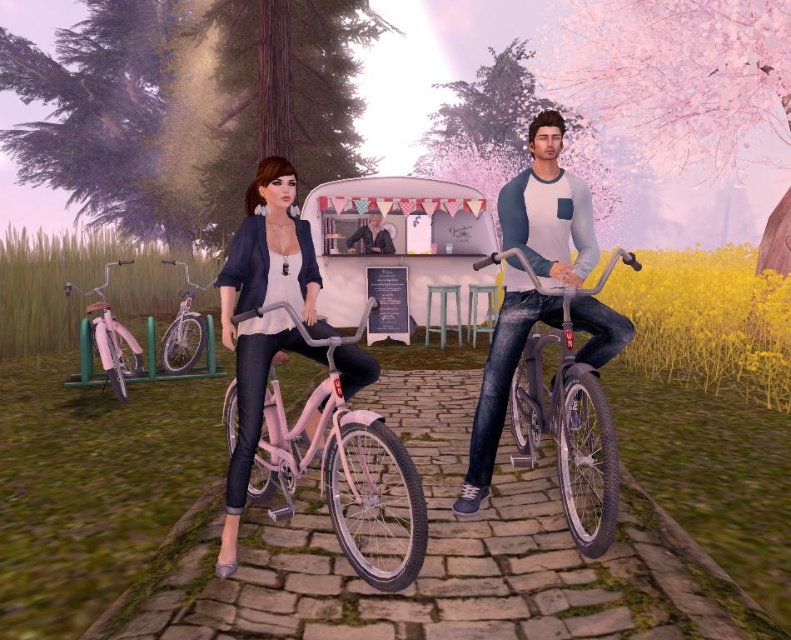
Does denim jeans at center appear on the right side of smooth black jacket at center?

Correct, you'll find denim jeans at center to the right of smooth black jacket at center.

Which of these two, denim jeans at center or smooth black jacket at center, stands taller?

denim jeans at center is taller.

Does point (555, 189) lie in front of point (354, 232)?

Yes.

The width and height of the screenshot is (791, 640). I want to click on denim jeans at center, so 547,211.

Describe the element at coordinates (110, 336) in the screenshot. The height and width of the screenshot is (640, 791). I see `pink matte bicycle at left` at that location.

Does pink matte bicycle at left have a greater height compared to shiny silver bicycle at left?

Incorrect, pink matte bicycle at left's height is not larger of shiny silver bicycle at left's.

The height and width of the screenshot is (640, 791). What do you see at coordinates (110, 336) in the screenshot?
I see `pink matte bicycle at left` at bounding box center [110, 336].

Identify the location of pink matte bicycle at left. (110, 336).

Which is in front, point (195, 323) or point (388, 248)?

Point (195, 323)

Is shiny silver bicycle at left taller than smooth black jacket at center?

Indeed, shiny silver bicycle at left has a greater height compared to smooth black jacket at center.

Does point (180, 365) lie behind point (368, 225)?

No, (180, 365) is in front of (368, 225).

Where is `shiny silver bicycle at left`? This screenshot has height=640, width=791. shiny silver bicycle at left is located at coordinates (184, 330).